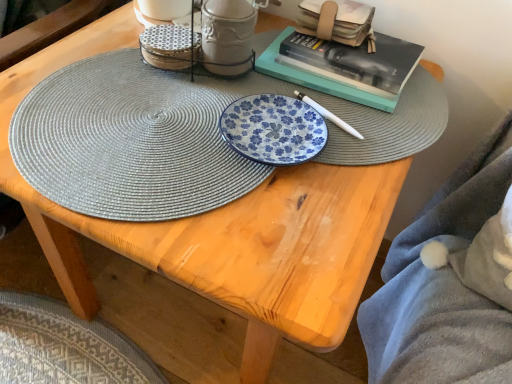
Locate an element on the screen. The width and height of the screenshot is (512, 384). empty space that is to the right of matte ceramic mug at upper center, which ranks as the first tableware in right-to-left order is located at coordinates (318, 105).